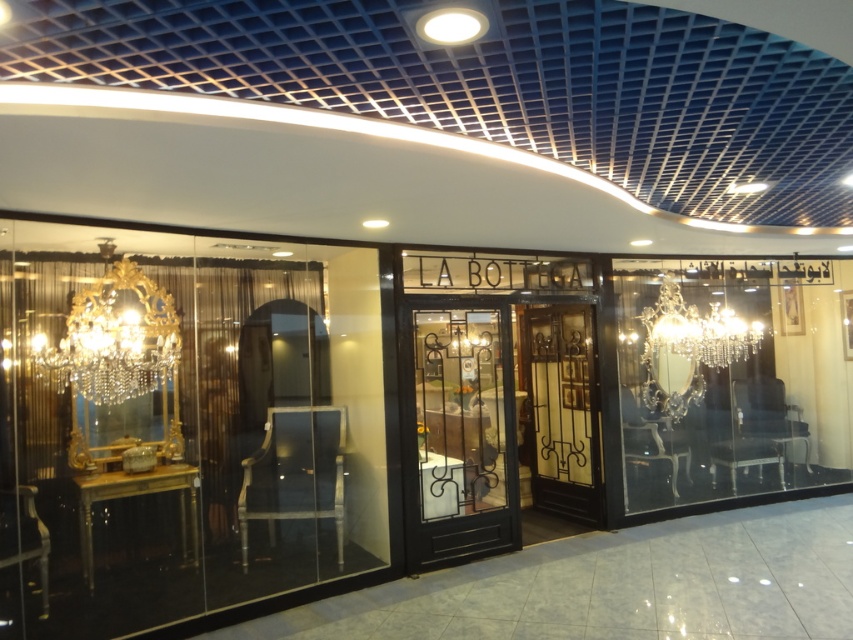
Between black wrought iron door at center and clear crystal chandelier at center, which one appears on the right side from the viewer's perspective?

clear crystal chandelier at center

Which is below, black wrought iron door at center or clear crystal chandelier at center?

Positioned lower is black wrought iron door at center.

Describe the element at coordinates (457, 435) in the screenshot. I see `black wrought iron door at center` at that location.

You are a GUI agent. You are given a task and a screenshot of the screen. Output one action in this format:
    pyautogui.click(x=<x>, y=<y>)
    Task: Click on the black wrought iron door at center
    The image size is (853, 640).
    Given the screenshot: What is the action you would take?
    pyautogui.click(x=457, y=435)

Does gold crystal chandelier at left appear under clear crystal chandelier at center?

Indeed, gold crystal chandelier at left is positioned under clear crystal chandelier at center.

Describe the element at coordinates (115, 337) in the screenshot. This screenshot has width=853, height=640. I see `gold crystal chandelier at left` at that location.

The image size is (853, 640). I want to click on gold crystal chandelier at left, so coord(115,337).

Is black wrought iron door at center taller than gold crystal chandelier at left?

Correct, black wrought iron door at center is much taller as gold crystal chandelier at left.

Is point (511, 476) positioned in front of point (86, 305)?

No, it is not.

The width and height of the screenshot is (853, 640). What do you see at coordinates (457, 435) in the screenshot? I see `black wrought iron door at center` at bounding box center [457, 435].

The height and width of the screenshot is (640, 853). What are the coordinates of `black wrought iron door at center` in the screenshot? It's located at (457, 435).